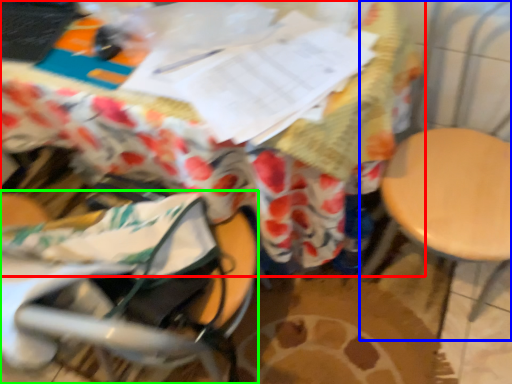
Question: Which object is the closest to the table (highlighted by a red box)? Choose among these: swivel chair (highlighted by a blue box) or baby carriage (highlighted by a green box).

Choices:
 (A) swivel chair
 (B) baby carriage

Answer: (B)